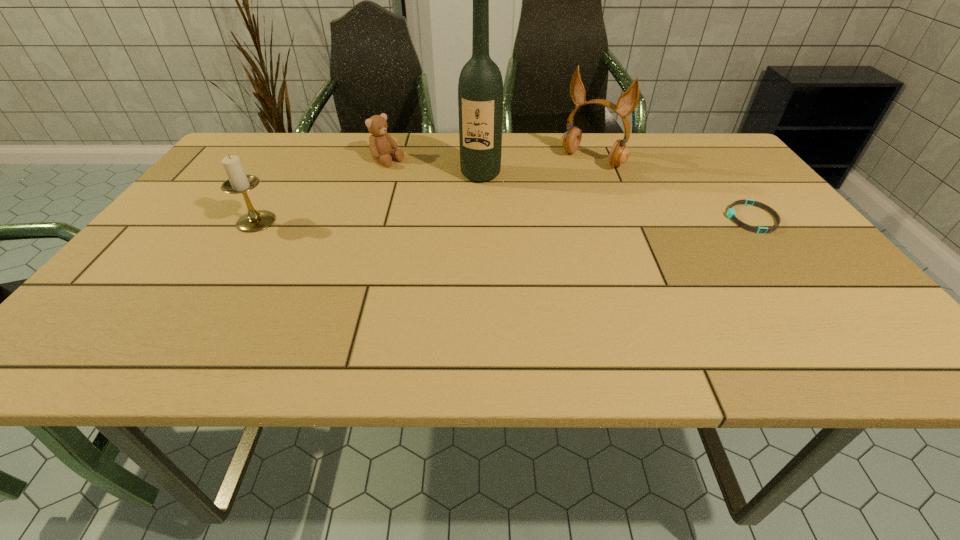
This screenshot has width=960, height=540. I want to click on free space located 0.170m on the front of the leftmost object, so click(217, 285).

Where is `vacant space located on the buckle of the wristband`? Image resolution: width=960 pixels, height=540 pixels. vacant space located on the buckle of the wristband is located at coordinates pos(663,218).

Find the location of `vacant region located on the buckle of the wristband`. vacant region located on the buckle of the wristband is located at coordinates (563, 218).

Identify the location of vacant position located 0.060m on the buckle of the wristband. The image size is (960, 540). (702, 218).

Where is `free space located on the face of the second shortest object`? The image size is (960, 540). free space located on the face of the second shortest object is located at coordinates (471, 206).

This screenshot has height=540, width=960. Find the location of `vacant space located on the face of the second shortest object`. vacant space located on the face of the second shortest object is located at coordinates (495, 219).

Where is `free space located on the face of the second shortest object`? free space located on the face of the second shortest object is located at coordinates (505, 224).

This screenshot has width=960, height=540. Identify the location of vacant space located 0.270m on the front-facing side of the second object from right to left. (527, 217).

Where is `blank space located 0.070m on the front-facing side of the second object from right to left`? The width and height of the screenshot is (960, 540). blank space located 0.070m on the front-facing side of the second object from right to left is located at coordinates (565, 181).

Locate an element on the screen. vacant space located on the front-facing side of the second object from right to left is located at coordinates (543, 202).